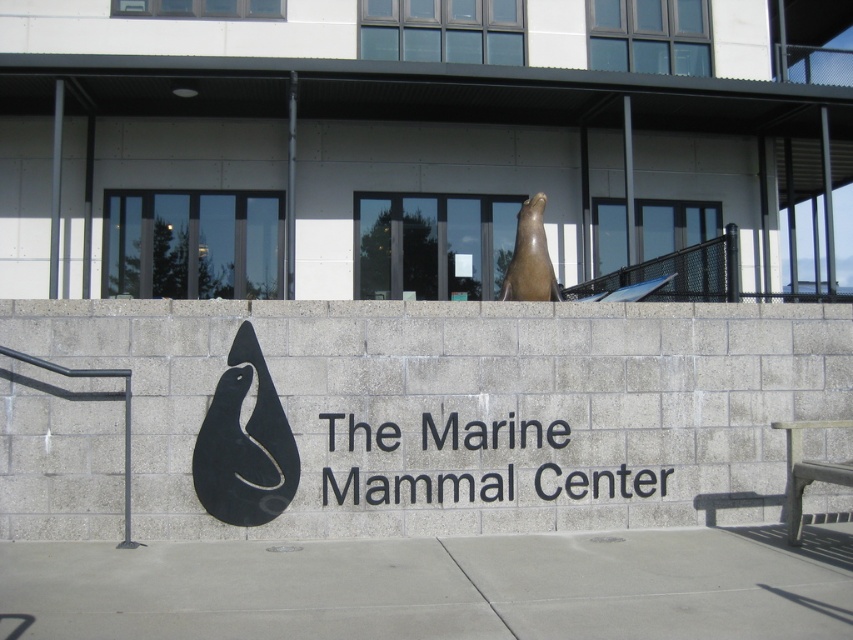
Looking at this image, you are standing at the entrance of The Marine Mammal Center and want to take a photo of the bronze statue of a marine mammal on top of the wall. The statue is located at point (x=231, y=436). You need to ensure that your camera can focus on objects at least 7 meters away. Will your camera be able to focus on the statue?

The distance between point (x=231, y=436) and the camera is 7.10 meters. Since the camera requires a minimum focus distance of 7 meters, the statue at point (x=231, y=436) is just beyond the minimum requirement, so the camera should be able to focus on it.

You are standing in front of The Marine Mammal Center and want to take a photo of the bronze statue of a marine mammal on top of the wall. The statue is located at point (267, 387). If you are 7.16 meters away from this point, will you be able to capture the entire statue in your photo?

The distance of point (267, 387) from viewer is 7.16 meters. Whether you can capture the entire statue depends on your camera lens. A standard lens might require being closer, but a wide angle could work at this distance.

You are standing in front of The Marine Mammal Center and want to take a photo that includes both the bronze statue and the logo. The statue is at point (231, 390) and the logo is at point (547, 252). Which point is closer to you so you can frame the photo better?

Point (231, 390) is closer to the viewer than point (547, 252), so the bronze statue is nearer to you. Frame the photo with the statue first as it is closer, then adjust to include the logo.